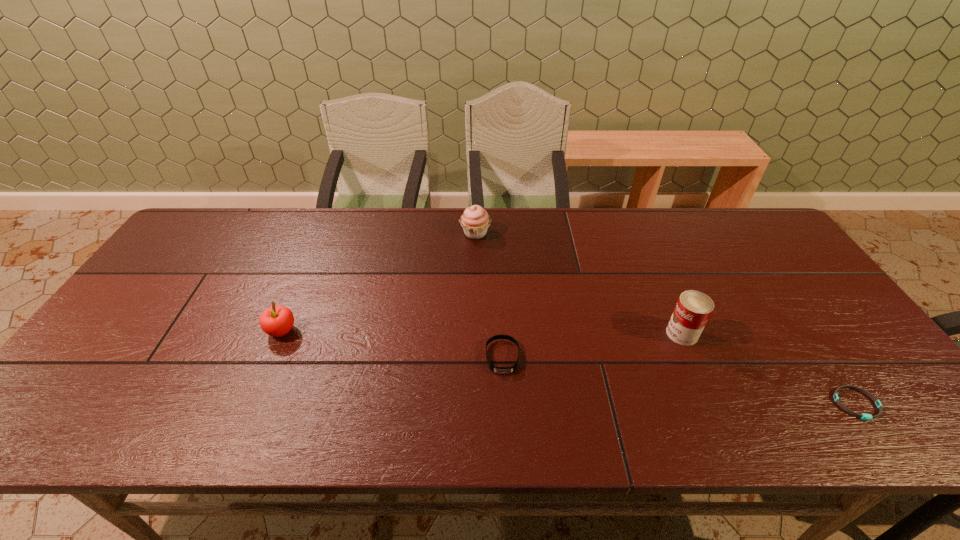
Locate an element on the screen. This screenshot has width=960, height=540. vacant area that lies between the third shortest object and the shorter wristband is located at coordinates (569, 368).

Find the location of a particular element. vacant space that is in between the third shortest object and the fourth object from left to right is located at coordinates (482, 332).

Identify which object is located as the nearest to the right wristband. Please provide its 2D coordinates. Your answer should be formatted as a tuple, i.e. [(x, y)], where the tuple contains the x and y coordinates of a point satisfying the conditions above.

[(693, 309)]

I want to click on object that ranks as the second closest to the nearest object, so click(500, 370).